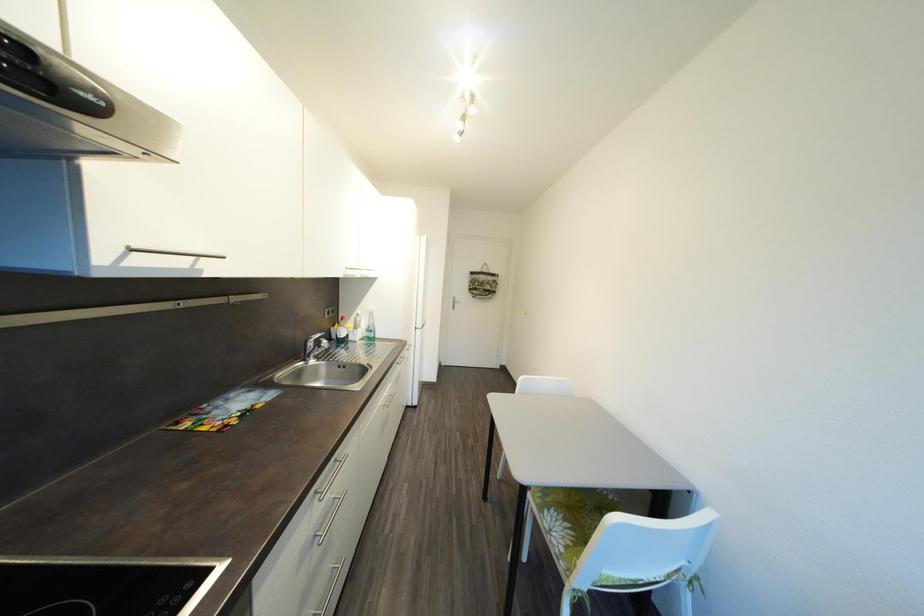
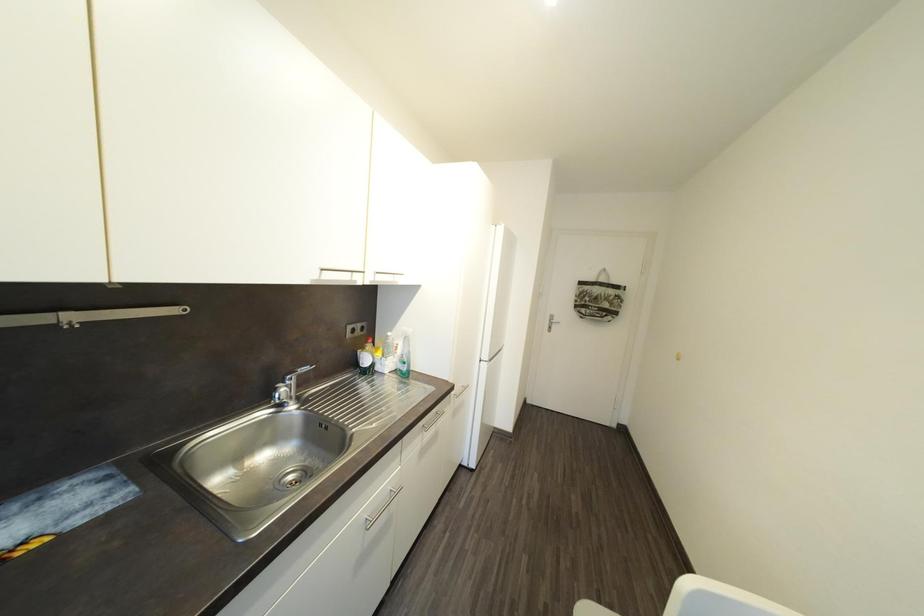
Question: The images are taken continuously from a first-person perspective. In which direction are you moving?

Choices:
 (A) Left
 (B) Right
 (C) Forward
 (D) Backward

Answer: (C)